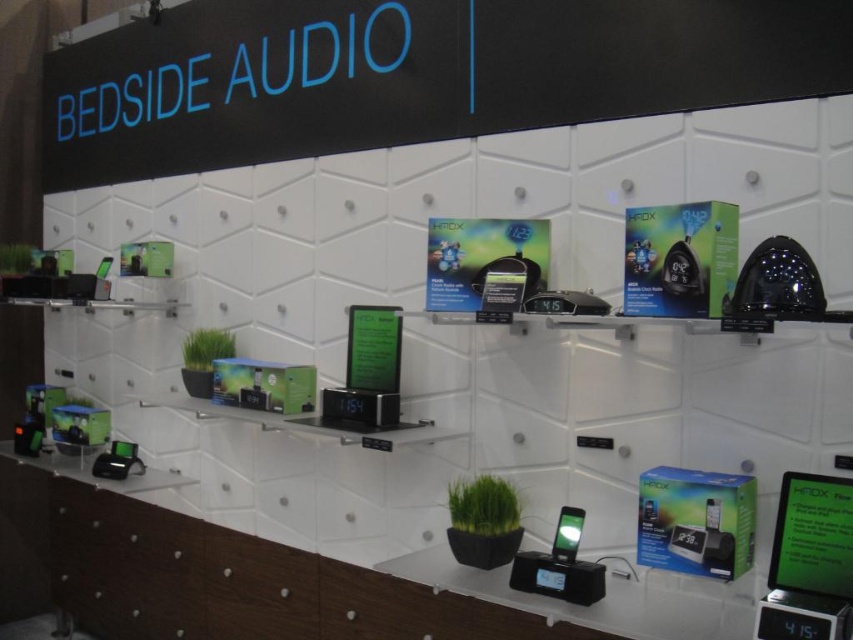
Which of these two, black plastic sign at upper center or matte black phone at center, stands taller?

black plastic sign at upper center is taller.

Looking at this image, is black plastic sign at upper center thinner than matte black phone at center?

No, black plastic sign at upper center is not thinner than matte black phone at center.

Is point (799, 52) closer to camera compared to point (575, 552)?

Yes, it is.

Find the location of `black plastic sign at upper center`. black plastic sign at upper center is located at coordinates (410, 74).